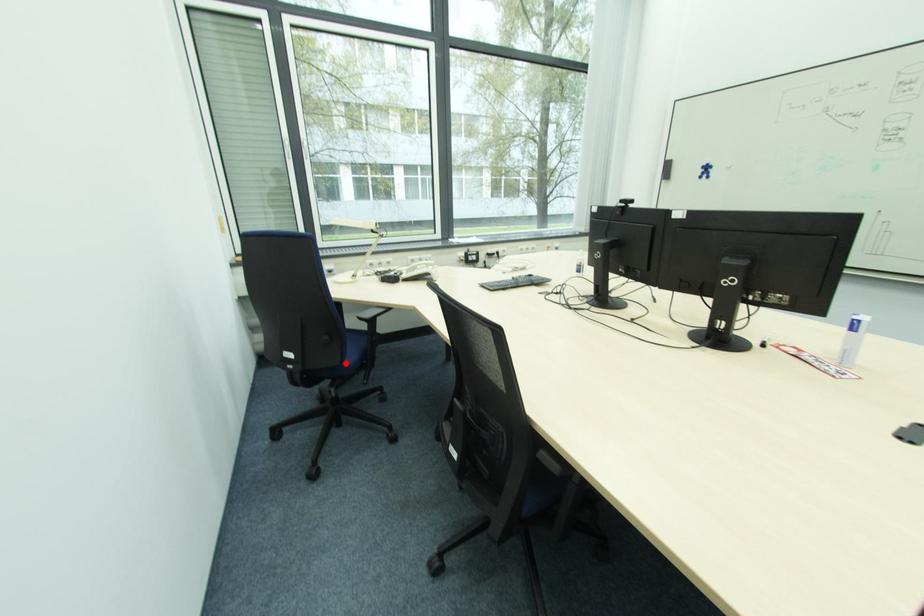
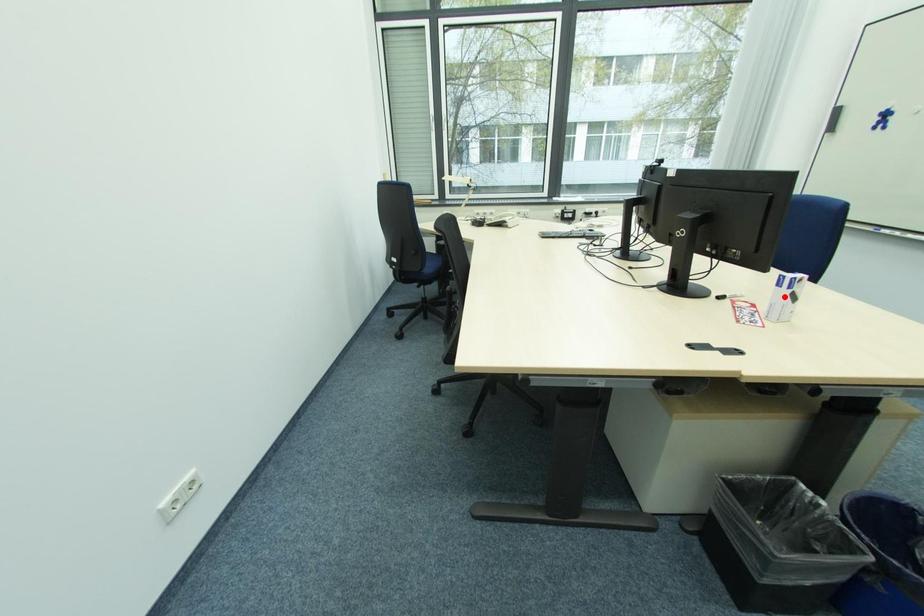
I am providing you with two images of the same scene from different viewpoints. A red point is marked on the first image and another point is marked on the second image. Are the points marked in image1 and image2 representing the same 3D position?

No